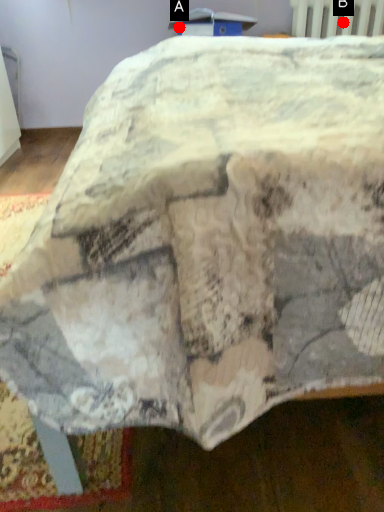
Question: Two points are circled on the image, labeled by A and B beside each circle. Among these points, which one is farthest from the camera?

Choices:
 (A) A is further
 (B) B is further

Answer: (B)